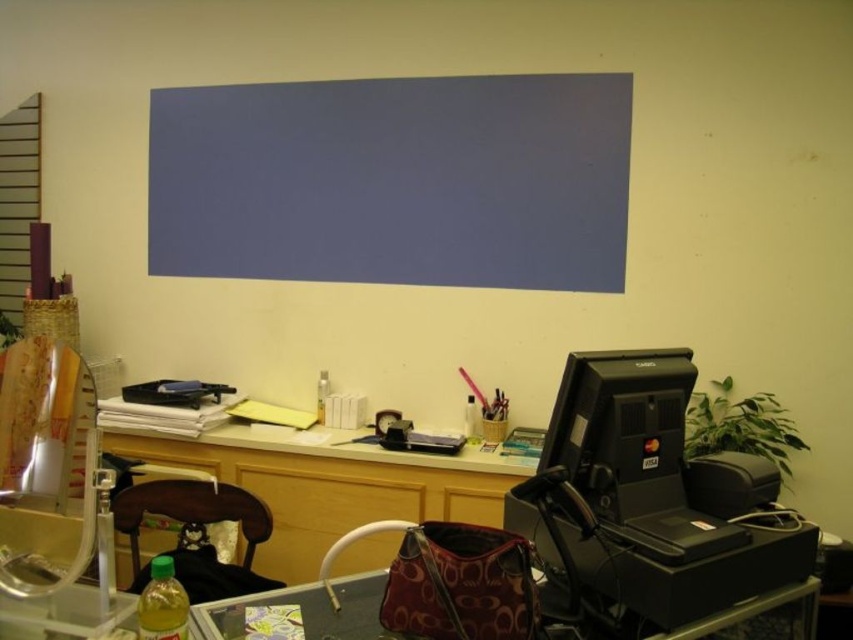
Question: Can you confirm if brown wood chair at lower left is smaller than leather-like brown bag at lower center?

Choices:
 (A) no
 (B) yes

Answer: (A)

Question: Is wooden desk at center positioned in front of leather-like brown bag at lower center?

Choices:
 (A) yes
 (B) no

Answer: (B)

Question: Can you confirm if wooden desk at center is positioned to the left of leather-like brown bag at lower center?

Choices:
 (A) yes
 (B) no

Answer: (A)

Question: Among these objects, which one is nearest to the camera?

Choices:
 (A) metal grid at left
 (B) black plastic printer at lower right
 (C) leather-like brown bag at lower center

Answer: (B)

Question: Which of these objects is positioned closest to the wooden desk at center?

Choices:
 (A) brown wood chair at lower left
 (B) metal grid at left
 (C) black plastic printer at lower right
 (D) leather-like brown bag at lower center

Answer: (A)

Question: Which of these objects is positioned closest to the wooden desk at center?

Choices:
 (A) brown wood chair at lower left
 (B) leather-like brown bag at lower center
 (C) black plastic printer at lower right
 (D) metal grid at left

Answer: (A)